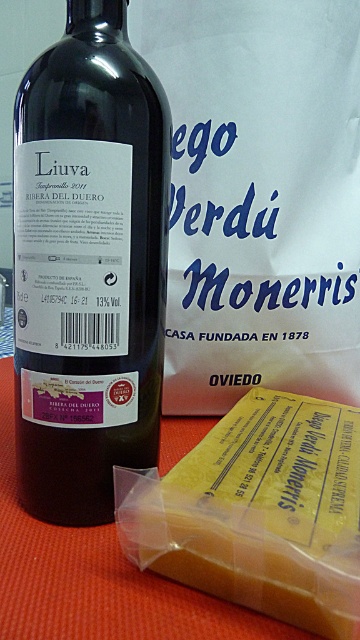
Is white paper at upper center above green glass bottle at center?

Correct, white paper at upper center is located above green glass bottle at center.

From the picture: Is white paper at upper center thinner than green glass bottle at center?

In fact, white paper at upper center might be wider than green glass bottle at center.

Locate an element on the screen. This screenshot has height=640, width=360. white paper at upper center is located at coordinates (258, 195).

Is green glass bottle at center wider than yellow cheese at lower right?

Yes, green glass bottle at center is wider than yellow cheese at lower right.

Describe the element at coordinates (93, 268) in the screenshot. I see `green glass bottle at center` at that location.

Measure the distance between point (150, 346) and camera.

A distance of 15.45 inches exists between point (150, 346) and camera.

Where is `green glass bottle at center`? This screenshot has width=360, height=640. green glass bottle at center is located at coordinates (93, 268).

Consider the image. Can you confirm if white paper at upper center is thinner than yellow cheese at lower right?

Incorrect, white paper at upper center's width is not less than yellow cheese at lower right's.

Who is higher up, white paper at upper center or yellow cheese at lower right?

Positioned higher is white paper at upper center.

Is point (277, 72) positioned in front of point (226, 552)?

No, it is not.

Where is `white paper at upper center`? The height and width of the screenshot is (640, 360). white paper at upper center is located at coordinates (258, 195).